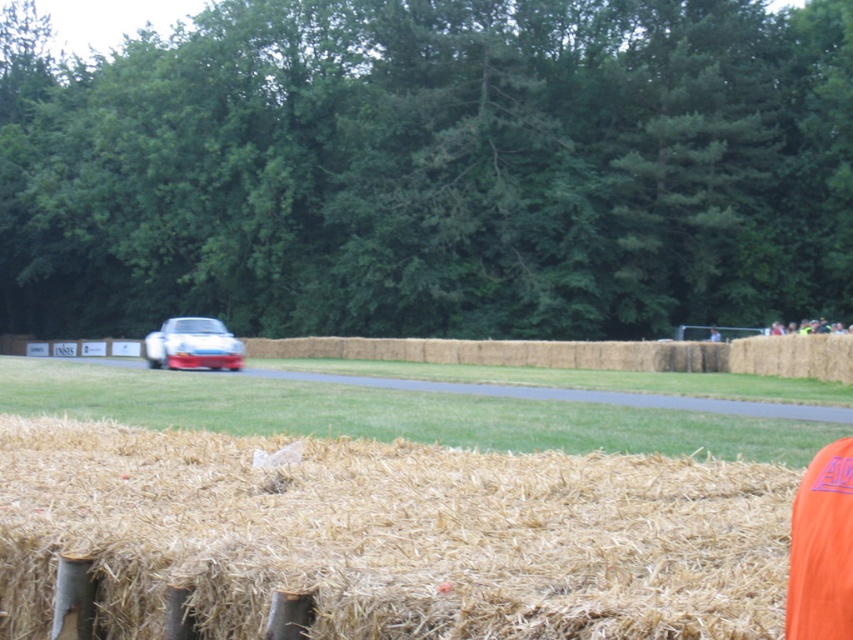
Question: Is straw bales at lower center below white glossy car at center?

Choices:
 (A) yes
 (B) no

Answer: (A)

Question: Can you confirm if straw bales at lower center is positioned below white glossy car at center?

Choices:
 (A) yes
 (B) no

Answer: (A)

Question: From the image, what is the correct spatial relationship of straw bales at lower center in relation to white glossy car at center?

Choices:
 (A) left
 (B) right

Answer: (B)

Question: Which object is farther from the camera taking this photo?

Choices:
 (A) straw bales at lower center
 (B) smooth asphalt road at center
 (C) white glossy car at center

Answer: (C)

Question: Which of the following is the closest to the observer?

Choices:
 (A) white glossy car at center
 (B) straw bales at lower center
 (C) smooth asphalt road at center

Answer: (B)

Question: Which point appears closest to the camera in this image?

Choices:
 (A) click(264, 493)
 (B) click(195, 342)

Answer: (A)